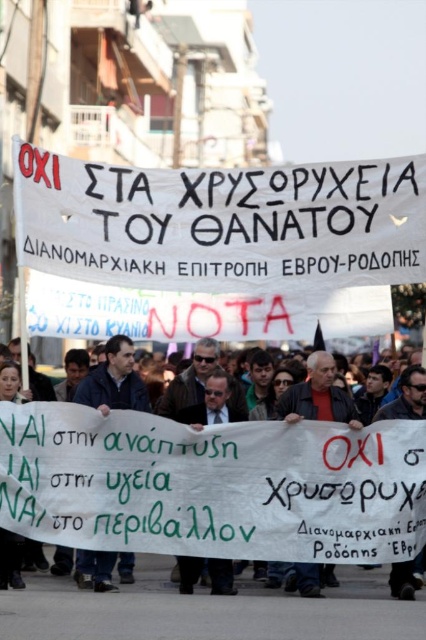
Question: Is white paper banner at center to the right of blue fabric at center from the viewer's perspective?

Choices:
 (A) no
 (B) yes

Answer: (B)

Question: Is white paper banner at center behind blue fabric at center?

Choices:
 (A) yes
 (B) no

Answer: (B)

Question: Which of the following is the closest to the observer?

Choices:
 (A) (115, 408)
 (B) (157, 536)

Answer: (B)

Question: Which point is closer to the camera?

Choices:
 (A) blue fabric at center
 (B) white paper banner at center

Answer: (B)

Question: Is white paper banner at center in front of blue fabric at center?

Choices:
 (A) no
 (B) yes

Answer: (B)